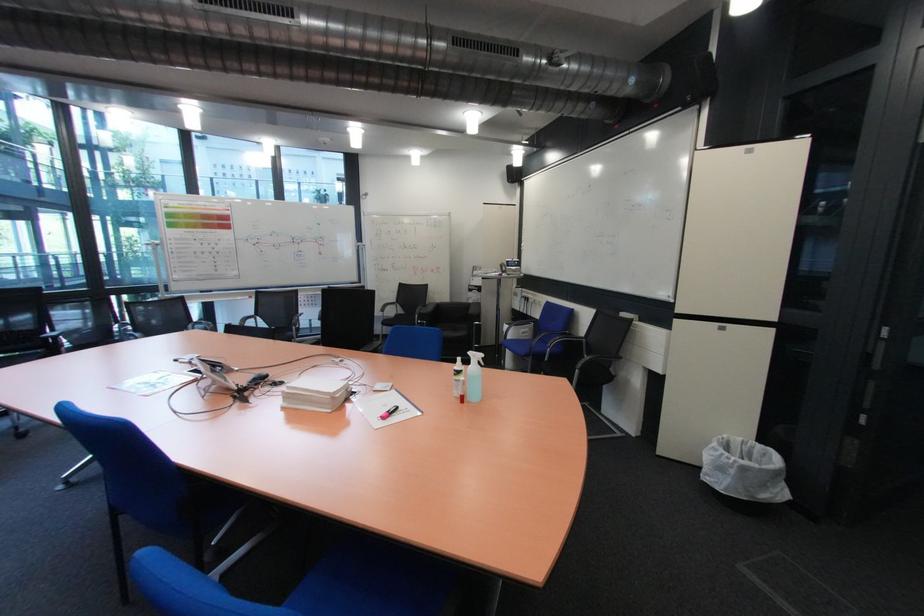
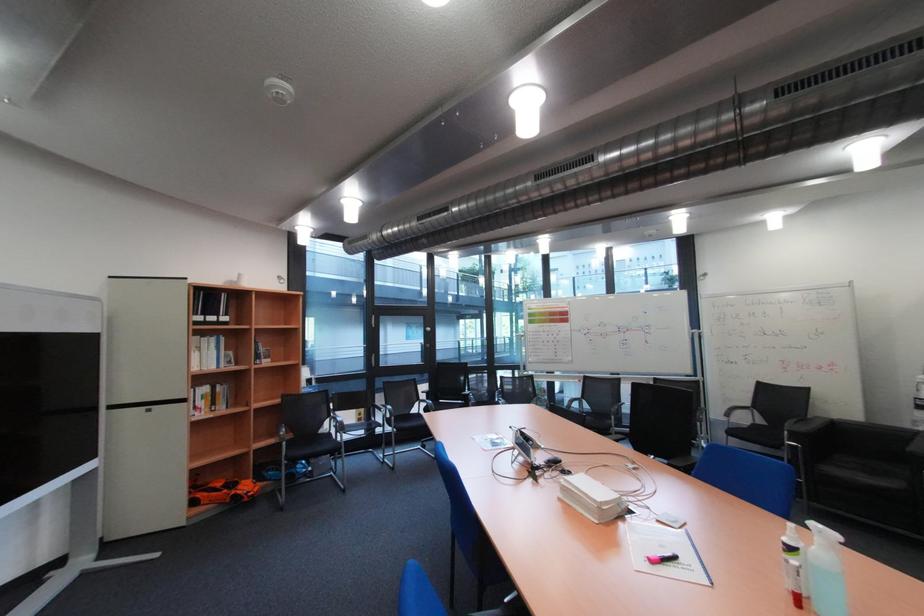
Question: The first image is from the beginning of the video and the second image is from the end. How did the camera likely rotate when shooting the video?

Choices:
 (A) Left
 (B) Right
 (C) Up
 (D) Down

Answer: (A)